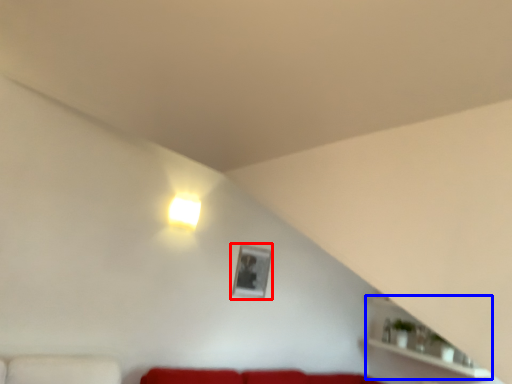
Question: Which object appears farthest to the camera in this image, picture frame (highlighted by a red box) or shelf (highlighted by a blue box)?

Choices:
 (A) picture frame
 (B) shelf

Answer: (A)